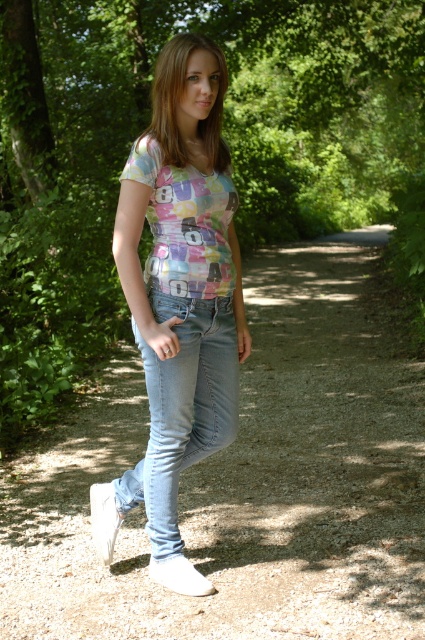
Can you confirm if white leather shoe at lower left is wider than white suede shoe at lower center?

Incorrect, white leather shoe at lower left's width does not surpass white suede shoe at lower center's.

In the scene shown: Is white leather shoe at lower left bigger than white suede shoe at lower center?

Indeed, white leather shoe at lower left has a larger size compared to white suede shoe at lower center.

This screenshot has width=425, height=640. I want to click on white leather shoe at lower left, so click(104, 518).

Is dirt path at center to the left of pastel printed t-shirt at center from the viewer's perspective?

No, dirt path at center is not to the left of pastel printed t-shirt at center.

Is dirt path at center further to the viewer compared to pastel printed t-shirt at center?

No, dirt path at center is closer to the viewer.

Who is more distant from viewer, (410,362) or (201,170)?

The point (410,362) is more distant.

Where is `dirt path at center`? This screenshot has width=425, height=640. dirt path at center is located at coordinates (244, 483).

Is light blue denim jeans at center below white leather shoe at lower left?

No.

Who is positioned more to the left, light blue denim jeans at center or white leather shoe at lower left?

Positioned to the left is white leather shoe at lower left.

Describe the element at coordinates (183, 410) in the screenshot. I see `light blue denim jeans at center` at that location.

Find the location of `light blue denim jeans at center`. light blue denim jeans at center is located at coordinates (183, 410).